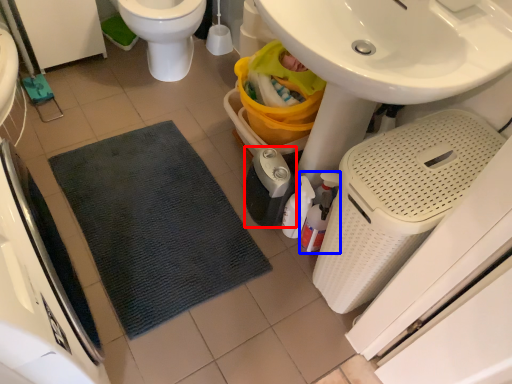
Question: Among these objects, which one is nearest to the camera, appliance (highlighted by a red box) or cleaning product (highlighted by a blue box)?

Choices:
 (A) appliance
 (B) cleaning product

Answer: (B)